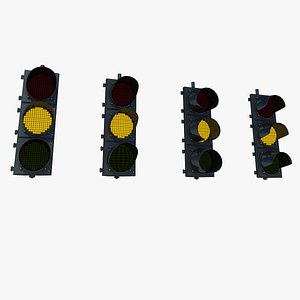
This screenshot has width=300, height=300. I want to click on light2, so click(x=111, y=110).